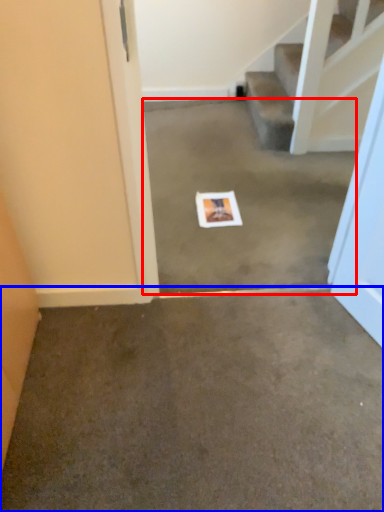
Question: Which point is further to the camera, concrete (highlighted by a red box) or concrete (highlighted by a blue box)?

Choices:
 (A) concrete
 (B) concrete

Answer: (A)